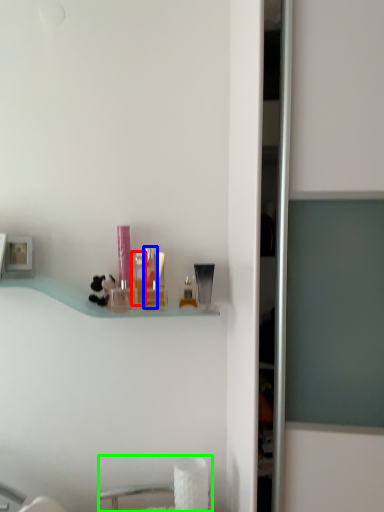
Question: Which object is positioned closest to toiletry (highlighted by a red box)? Select from toiletry (highlighted by a blue box) and sink (highlighted by a green box).

Choices:
 (A) toiletry
 (B) sink

Answer: (A)